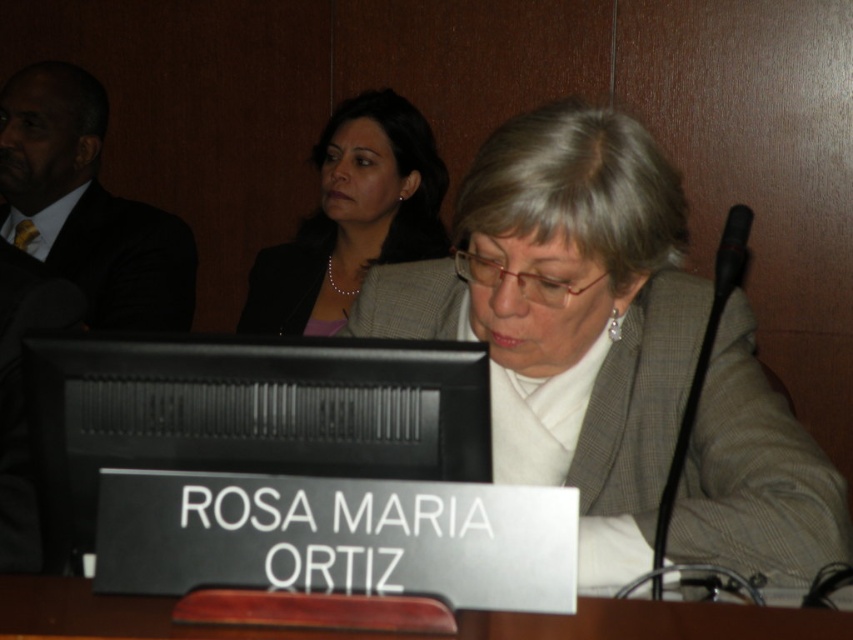
You are standing at the entrance of the conference room and want to approach the brown wood table at center. Based on the coordinates provided, in which direction should you walk to reach the table?

The brown wood table at center is located at coordinates point (405,634), so you should walk forward towards the center of the room to reach it.

You are standing in the conference room and want to walk towards the two points marked in the image. Which point, point (570,616) or point (274,269), is closer to you?

Point (570,616) is closer to you than point (274,269).